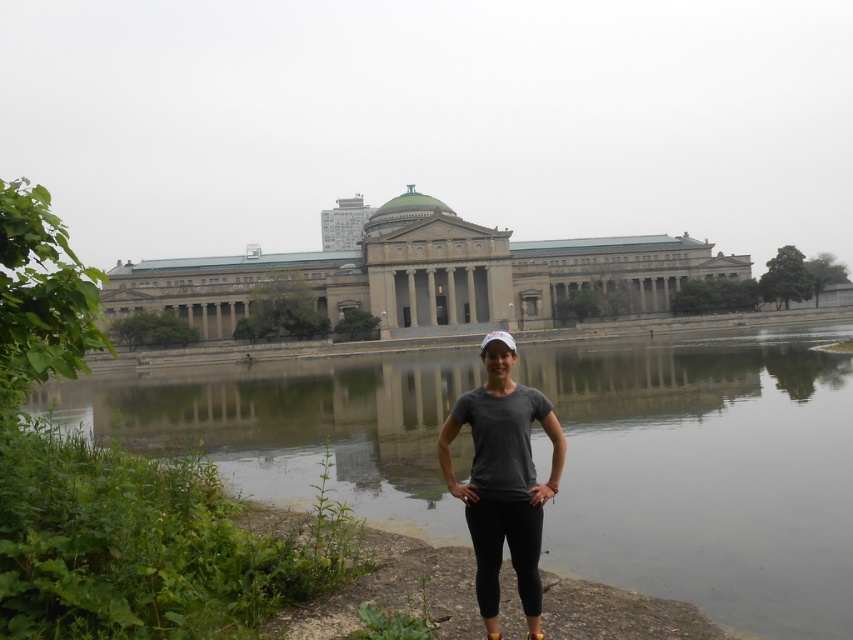
Question: Which of the following is the closest to the observer?

Choices:
 (A) gray stone building at center
 (B) smooth concrete river at center

Answer: (B)

Question: Which point is closer to the camera?

Choices:
 (A) (196, 305)
 (B) (476, 410)

Answer: (B)

Question: Does gray stone building at center have a smaller size compared to gray matte t-shirt at center?

Choices:
 (A) yes
 (B) no

Answer: (B)

Question: Does smooth concrete river at center have a larger size compared to gray matte t-shirt at center?

Choices:
 (A) no
 (B) yes

Answer: (B)

Question: Which point is closer to the camera?

Choices:
 (A) (525, 419)
 (B) (132, 305)
 (C) (848, 371)

Answer: (A)

Question: Is smooth concrete river at center further to camera compared to gray stone building at center?

Choices:
 (A) yes
 (B) no

Answer: (B)